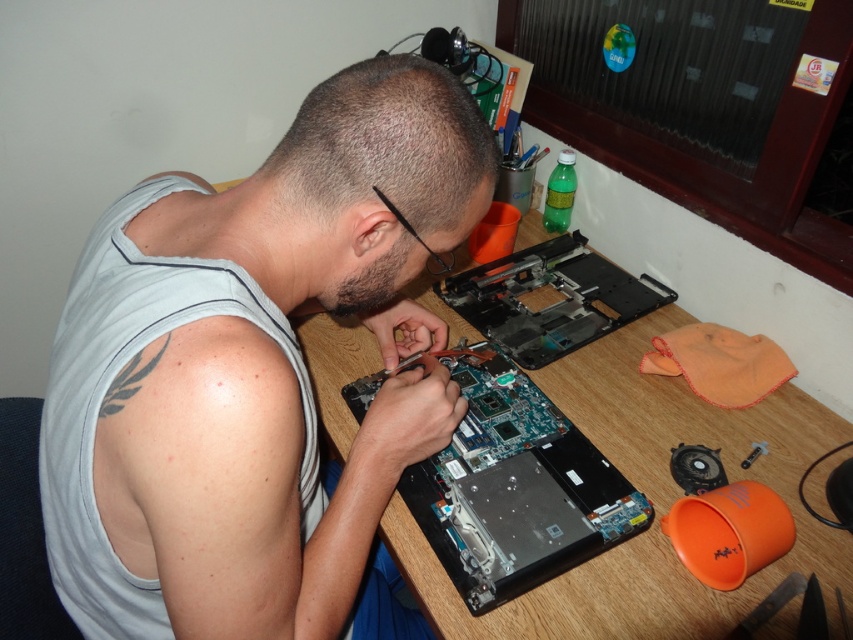
Locate an element on the screen. This screenshot has width=853, height=640. wooden table at center is located at coordinates click(x=653, y=502).

Can you confirm if wooden table at center is shorter than blue circuit board at center?

Incorrect, wooden table at center's height does not fall short of blue circuit board at center's.

Identify the location of wooden table at center. (653, 502).

This screenshot has width=853, height=640. What do you see at coordinates (252, 368) in the screenshot? I see `gray matte tank top at center` at bounding box center [252, 368].

Does gray matte tank top at center have a greater width compared to blue circuit board at center?

Yes.

Who is more distant from viewer, (177, 477) or (519, 540)?

Point (519, 540)

Identify the location of gray matte tank top at center. This screenshot has height=640, width=853. (252, 368).

Is point (303, 262) in front of point (527, 227)?

Yes, point (303, 262) is closer to viewer.

Which is more to the right, gray matte tank top at center or wooden table at center?

wooden table at center

The image size is (853, 640). What are the coordinates of `gray matte tank top at center` in the screenshot? It's located at (252, 368).